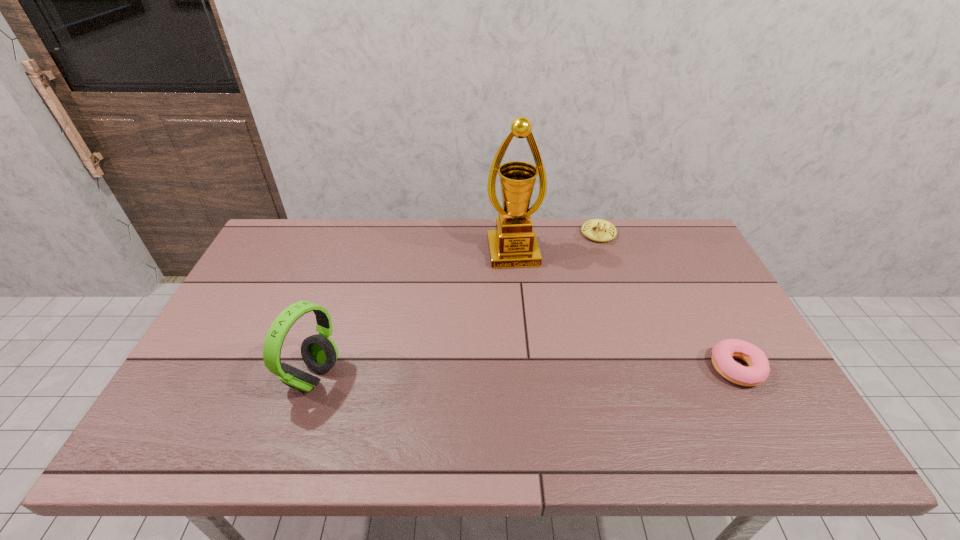
Image resolution: width=960 pixels, height=540 pixels. In order to click on vacant space situated 0.310m on the front-facing side of the award in this screenshot , I will do `click(533, 346)`.

Find the location of a particular element. vacant area situated on the front-facing side of the award is located at coordinates (522, 298).

This screenshot has width=960, height=540. Identify the location of vacant region located on the front-facing side of the award. (519, 284).

Identify the location of free region located on the face of the duckling. (587, 330).

The image size is (960, 540). What are the coordinates of `blank area located 0.060m on the face of the duckling` in the screenshot? It's located at (596, 256).

Where is `vacant space situated on the face of the duckling`? The width and height of the screenshot is (960, 540). vacant space situated on the face of the duckling is located at coordinates (593, 276).

Identify the location of award present at the far edge. The height and width of the screenshot is (540, 960). (513, 244).

I want to click on duckling present at the far edge, so click(x=600, y=235).

This screenshot has height=540, width=960. In order to click on headset that is at the near edge in this screenshot , I will do `click(319, 352)`.

This screenshot has width=960, height=540. I want to click on doughnut at the near edge, so click(758, 371).